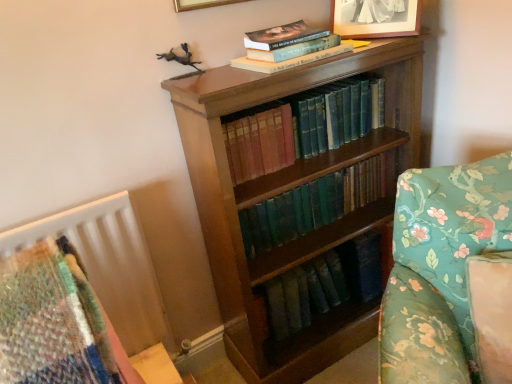
Question: From a real-world perspective, is green leather book at center, arranged as the 1th book when ordered from the bottom, physically above floral fabric sofa at right?

Choices:
 (A) no
 (B) yes

Answer: (B)

Question: Is green leather book at center, arranged as the 1th book when ordered from the bottom, positioned behind floral fabric sofa at right?

Choices:
 (A) yes
 (B) no

Answer: (A)

Question: From a real-world perspective, is green leather book at center, arranged as the 3th book when viewed from the top, located beneath floral fabric sofa at right?

Choices:
 (A) no
 (B) yes

Answer: (A)

Question: Can you confirm if green leather book at center, arranged as the 1th book when ordered from the bottom, is smaller than floral fabric sofa at right?

Choices:
 (A) yes
 (B) no

Answer: (A)

Question: Considering the relative sizes of green leather book at center, arranged as the 3th book when viewed from the top, and floral fabric sofa at right in the image provided, is green leather book at center, arranged as the 3th book when viewed from the top, bigger than floral fabric sofa at right?

Choices:
 (A) no
 (B) yes

Answer: (A)

Question: Based on their positions, is matte silver picture frame at upper center located to the left or right of wooden bookcase at center?

Choices:
 (A) left
 (B) right

Answer: (B)

Question: Is matte silver picture frame at upper center situated inside wooden bookcase at center or outside?

Choices:
 (A) inside
 (B) outside

Answer: (B)

Question: From a real-world perspective, is matte silver picture frame at upper center physically located above or below wooden bookcase at center?

Choices:
 (A) below
 (B) above

Answer: (B)

Question: Considering the positions of point (364, 36) and point (269, 364), is point (364, 36) closer or farther from the camera than point (269, 364)?

Choices:
 (A) farther
 (B) closer

Answer: (B)

Question: Visually, is wooden bookcase at center positioned to the left or to the right of floral fabric sofa at right?

Choices:
 (A) right
 (B) left

Answer: (B)

Question: From the image's perspective, is wooden bookcase at center positioned above or below floral fabric sofa at right?

Choices:
 (A) above
 (B) below

Answer: (A)

Question: In the image, is wooden bookcase at center positioned in front of or behind floral fabric sofa at right?

Choices:
 (A) front
 (B) behind

Answer: (B)

Question: From a real-world perspective, is wooden bookcase at center above or below floral fabric sofa at right?

Choices:
 (A) above
 (B) below

Answer: (A)

Question: Considering the positions of point (437, 231) and point (270, 61), is point (437, 231) closer or farther from the camera than point (270, 61)?

Choices:
 (A) farther
 (B) closer

Answer: (B)

Question: In terms of size, does floral fabric sofa at right appear bigger or smaller than hardcover book at upper center, which is the first book in top-to-bottom order?

Choices:
 (A) small
 (B) big

Answer: (B)